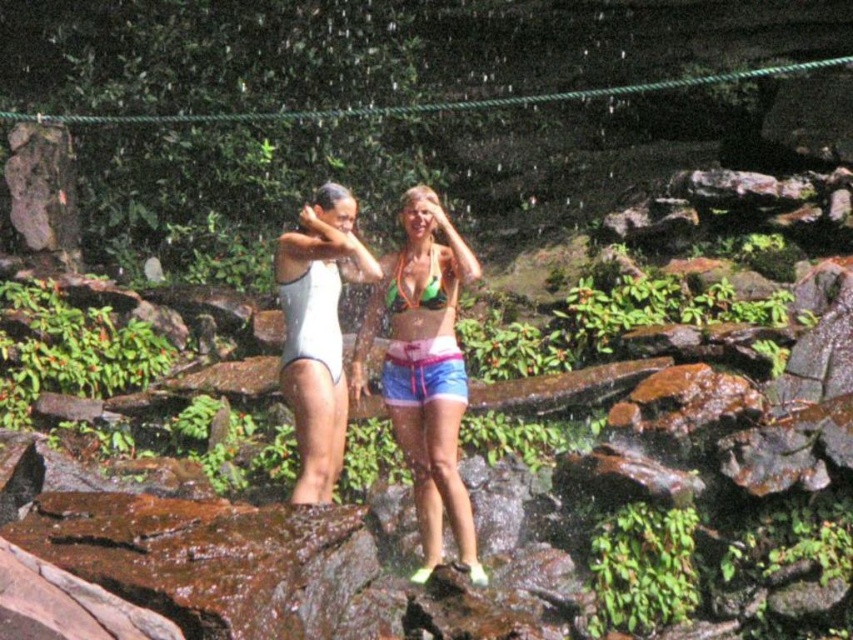
You are a photographer trying to capture both the white matte swimsuit at center and the multicolored fabric shorts at center in a single shot. Since you want both to be in focus, which one should you adjust your camera focus towards first?

You should focus on the white matte swimsuit at center first because it is closer to the viewer than the multicolored fabric shorts at center, ensuring that both will be in focus when you adjust the focus accordingly.

You are a photographer trying to capture a closeup of the white matte swimsuit at center. The camera you are using has a focus point at coordinates point [318,332]. Will this focus point help you capture the white matte swimsuit at center clearly?

Yes, the focus point at point [318,332] is on the white matte swimsuit at center, so it will help capture it clearly.

You are a photographer trying to capture the white matte swimsuit at center in the image. What are the coordinates where you should focus your camera?

The white matte swimsuit at center is located at coordinates point (318, 332).